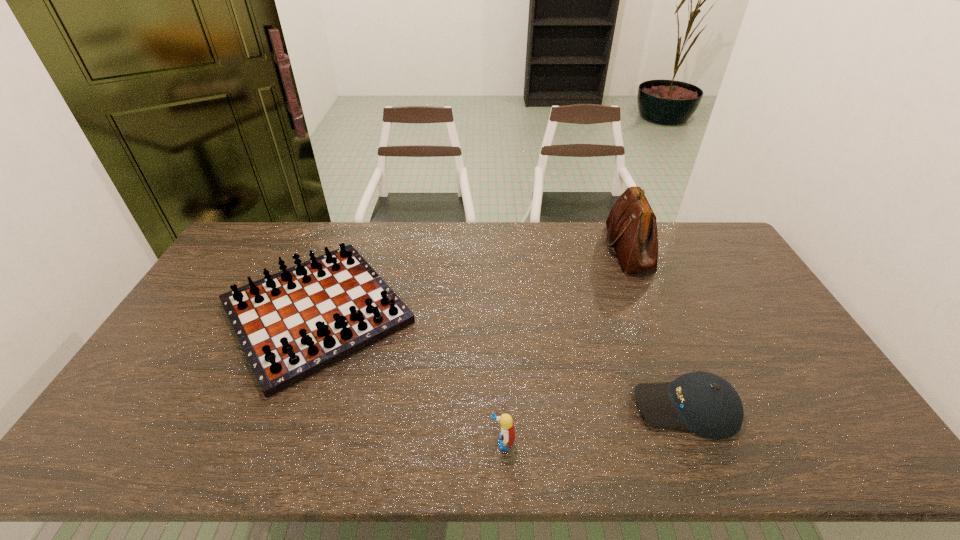
Image resolution: width=960 pixels, height=540 pixels. I want to click on free location at the right edge of the desktop, so click(x=746, y=294).

In the image, there is a desktop. At what (x,y) coordinates should I click in order to perform the action: click on vacant space at the far left corner. Please return your answer as a coordinate pair (x, y). This screenshot has height=540, width=960. Looking at the image, I should click on (275, 249).

Locate an element on the screen. This screenshot has width=960, height=540. free space between the leftmost object and the Lego is located at coordinates (410, 377).

Find the location of `empty location between the third object from right to left and the baseball cap`. empty location between the third object from right to left and the baseball cap is located at coordinates (594, 425).

Where is `free space between the Lego and the shortest object`? free space between the Lego and the shortest object is located at coordinates (594, 425).

The image size is (960, 540). What are the coordinates of `free space between the third object from right to left and the tallest object` in the screenshot? It's located at (565, 345).

Locate an element on the screen. vacant point located between the leftmost object and the third object from right to left is located at coordinates (410, 377).

At what (x,y) coordinates should I click in order to perform the action: click on vacant space that is in between the shoulder bag and the Lego. Please return your answer as a coordinate pair (x, y). The width and height of the screenshot is (960, 540). Looking at the image, I should click on (565, 345).

Locate an element on the screen. The height and width of the screenshot is (540, 960). free space that is in between the shortest object and the second object from left to right is located at coordinates (594, 425).

Identify the location of free space between the baseball cap and the Lego. Image resolution: width=960 pixels, height=540 pixels. (594, 425).